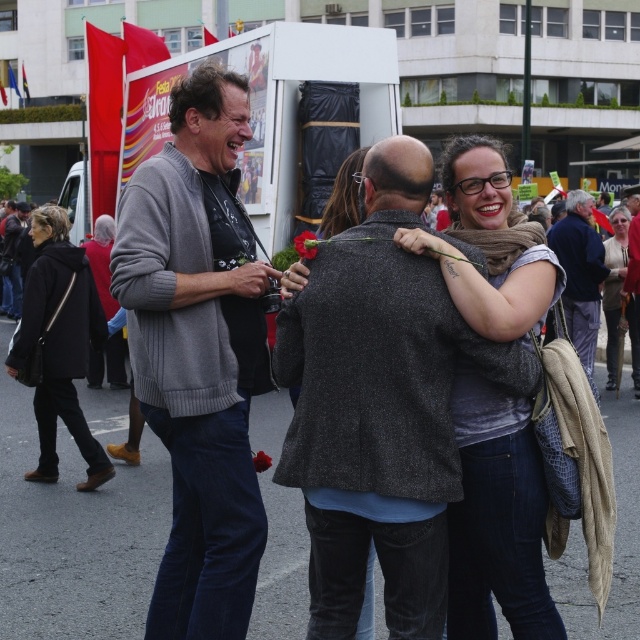
Question: Does dark blue coat at left appear on the right side of dark gray textured jacket at center?

Choices:
 (A) no
 (B) yes

Answer: (A)

Question: Is gray scarf at center smaller than dark gray textured jacket at center?

Choices:
 (A) yes
 (B) no

Answer: (A)

Question: Based on their relative distances, which object is nearer to the red matte flower at center?

Choices:
 (A) dark gray textured jacket at center
 (B) matte red flower at center

Answer: (B)

Question: Among these points, which one is farthest from the camera?

Choices:
 (A) pyautogui.click(x=298, y=250)
 (B) pyautogui.click(x=579, y=301)

Answer: (B)

Question: From the image, what is the correct spatial relationship of gray scarf at center in relation to red matte flower at center?

Choices:
 (A) left
 (B) right

Answer: (B)

Question: Which is nearer to the dark gray wool coat at center?

Choices:
 (A) dark blue coat at left
 (B) red matte flower at center
 (C) matte red flower at center

Answer: (C)